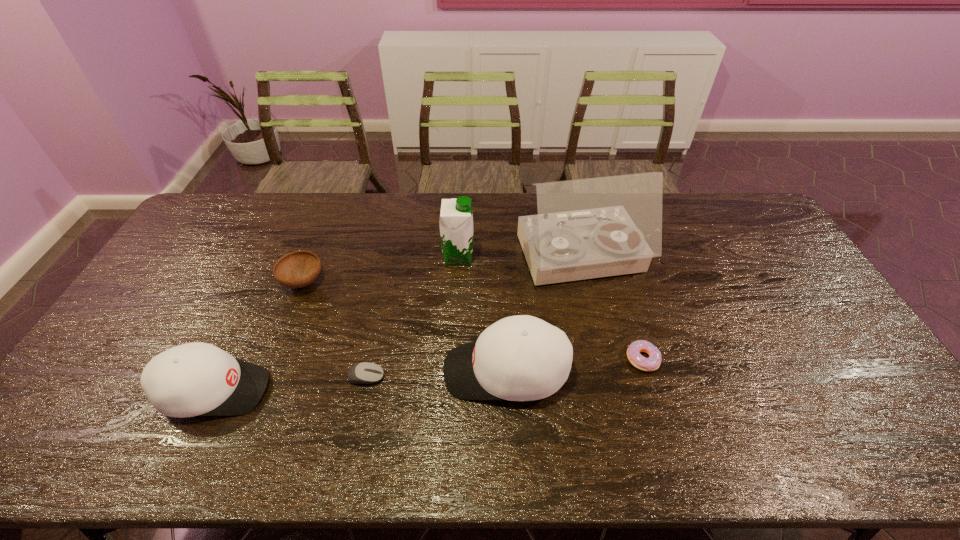
Find the location of a particular element. blank region between the record player and the fifth tallest object is located at coordinates (442, 270).

Locate an element on the screen. vacant point located between the record player and the sixth shortest object is located at coordinates (519, 258).

You are a GUI agent. You are given a task and a screenshot of the screen. Output one action in this format:
    pyautogui.click(x=<x>, y=<y>)
    Task: Click on the free spot between the left baseball cap and the third object from left to right
    This screenshot has width=960, height=540.
    Given the screenshot: What is the action you would take?
    pyautogui.click(x=290, y=383)

Find the location of `free space between the left baseball cap and the doughnut`. free space between the left baseball cap and the doughnut is located at coordinates (429, 375).

At what (x,y) coordinates should I click in order to perform the action: click on free space between the left baseball cap and the soya milk. Please return your answer as a coordinate pair (x, y). This screenshot has width=960, height=540. Looking at the image, I should click on (336, 324).

Identify which object is the fourth nearest to the shorter baseball cap. Please provide its 2D coordinates. Your answer should be formatted as a tuple, i.e. [(x, y)], where the tuple contains the x and y coordinates of a point satisfying the conditions above.

[(456, 218)]

Identify which object is the third nearest to the taller baseball cap. Please provide its 2D coordinates. Your answer should be formatted as a tuple, i.e. [(x, y)], where the tuple contains the x and y coordinates of a point satisfying the conditions above.

[(653, 362)]

This screenshot has height=540, width=960. Identify the location of vacant point that satisfies the following two spatial constraints: 1. on the front side of the record player; 2. on the front-facing side of the right baseball cap. (607, 371).

Locate an element on the screen. vacant space that satisfies the following two spatial constraints: 1. on the front-facing side of the tallest object; 2. on the right side of the second tallest object is located at coordinates (458, 258).

Locate an element on the screen. The width and height of the screenshot is (960, 540). vacant space that satisfies the following two spatial constraints: 1. on the back side of the fifth tallest object; 2. on the left side of the tallest object is located at coordinates (312, 258).